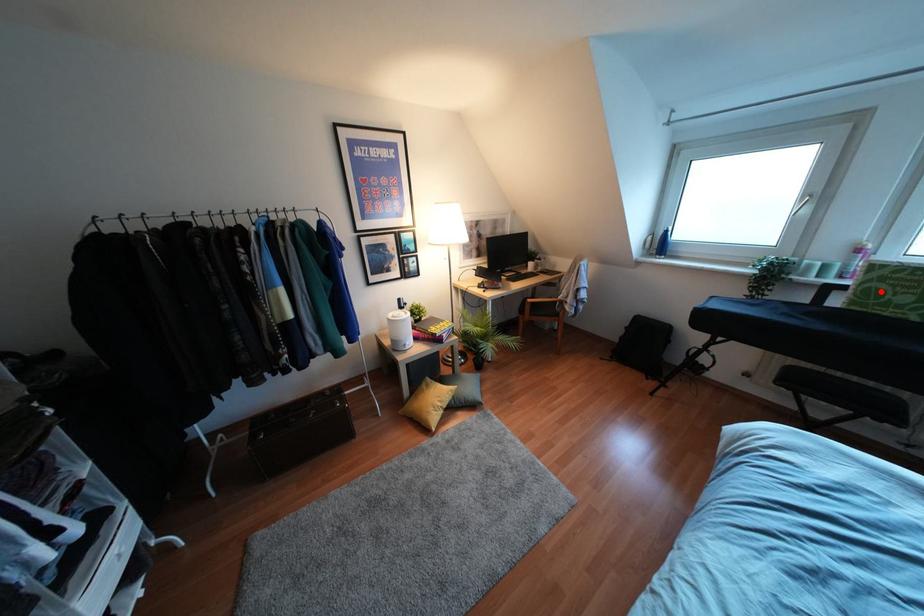
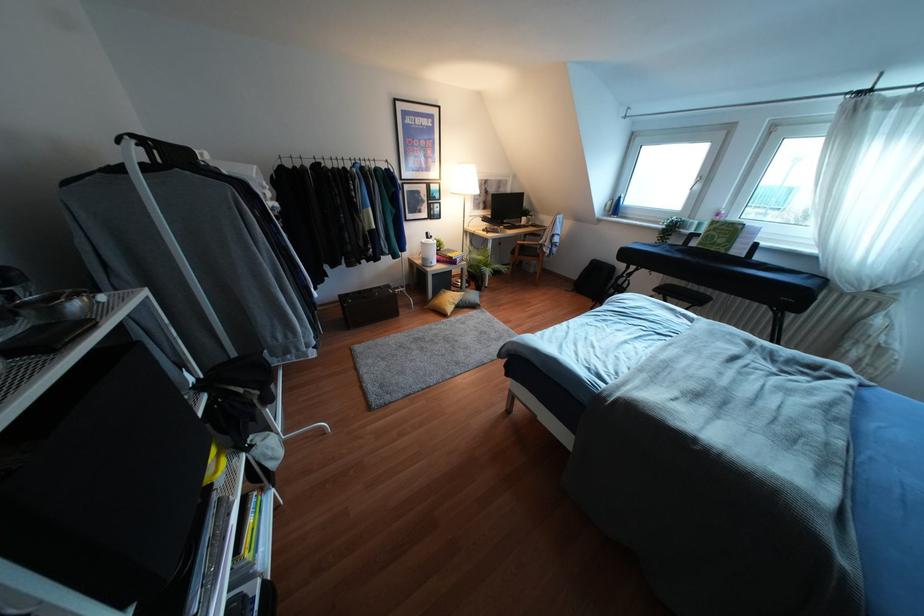
The point at the highlighted location is marked in the first image. Where is the corresponding point in the second image?

(712, 236)